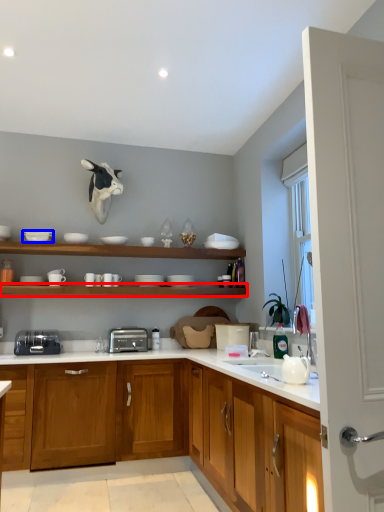
Question: Which of the following is the closest to the observer, shelf (highlighted by a red box) or tableware (highlighted by a blue box)?

Choices:
 (A) shelf
 (B) tableware

Answer: (A)